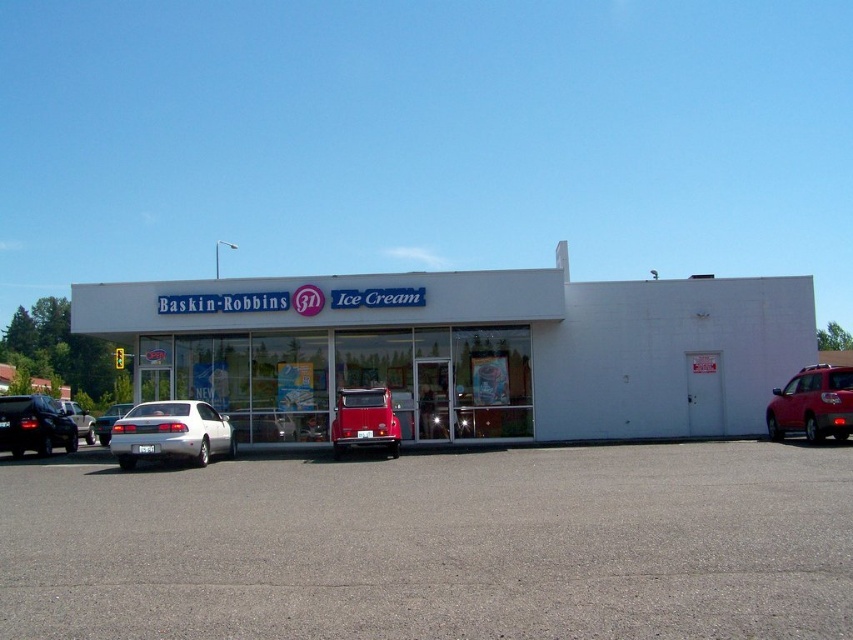
You are planning to park your car in the Baskin Robbins parking lot. You see the gray asphalt parking lot at lower center and the shiny red suv at right. Which one is larger in size?

The gray asphalt parking lot at lower center is bigger than the shiny red suv at right.

In the scene shown: You are driving a delivery truck that is 10 meters long and need to park between the shiny black sedan at left and the metallic red van at center. Is there enough space for your truck?

The distance between the shiny black sedan at left and the metallic red van at center is 11.25 meters. Since your truck is 10 meters long, there is enough space to park between them.